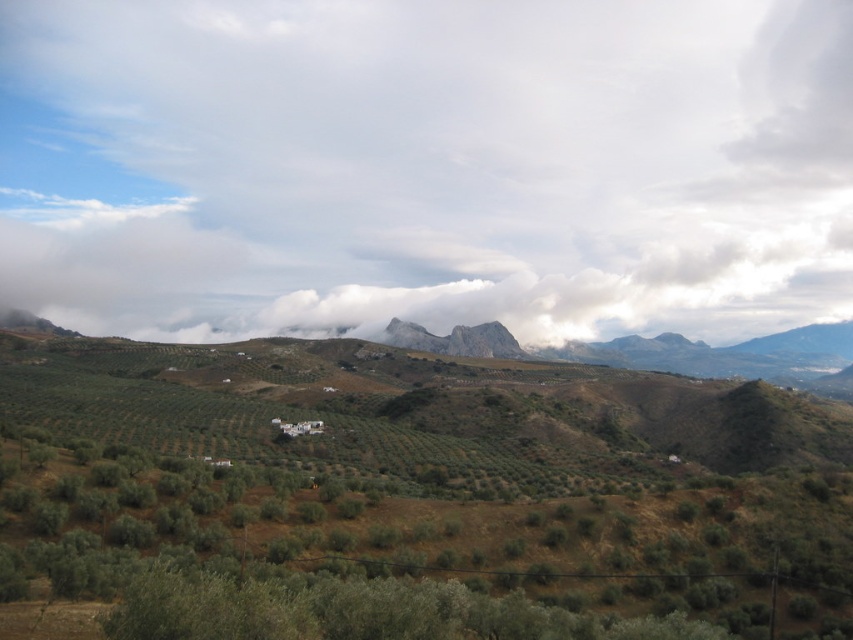
You are a landscape painter wanting to capture the scene. You notice the white fluffy cloud at upper center and the green leafy shrubs at center. Which one do you think is wider?

The white fluffy cloud at upper center might be wider than green leafy shrubs at center.

You are an airplane pilot flying over the landscape. You notice the white fluffy cloud at upper center. Where is it located in relation to the olive groves and the mountain range?

The white fluffy cloud at upper center is located at point coordinates of (427, 164), which is above the olive groves and the mountain range in the background.